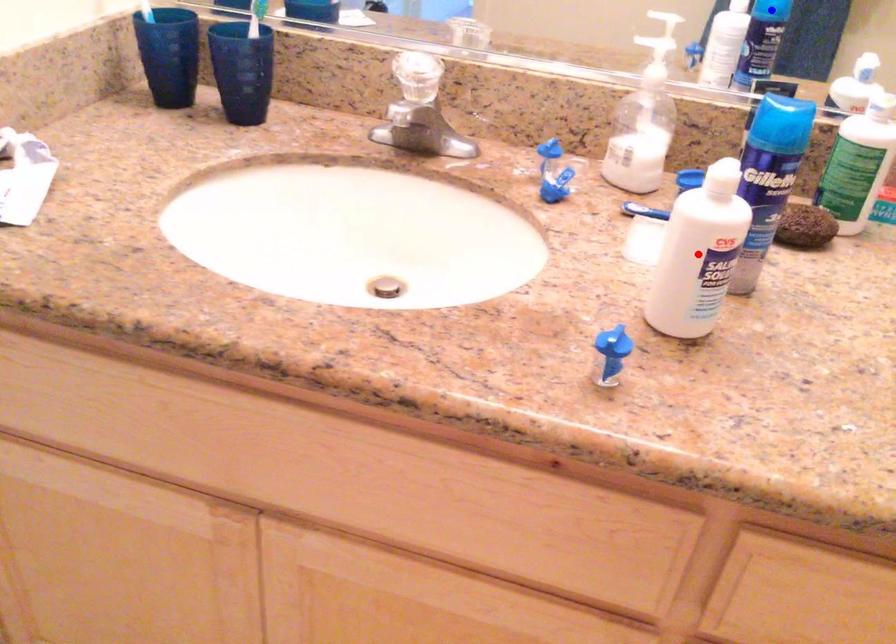
Question: Which of the two points in the image is closer to the camera?

Choices:
 (A) Blue point is closer.
 (B) Red point is closer.

Answer: (B)